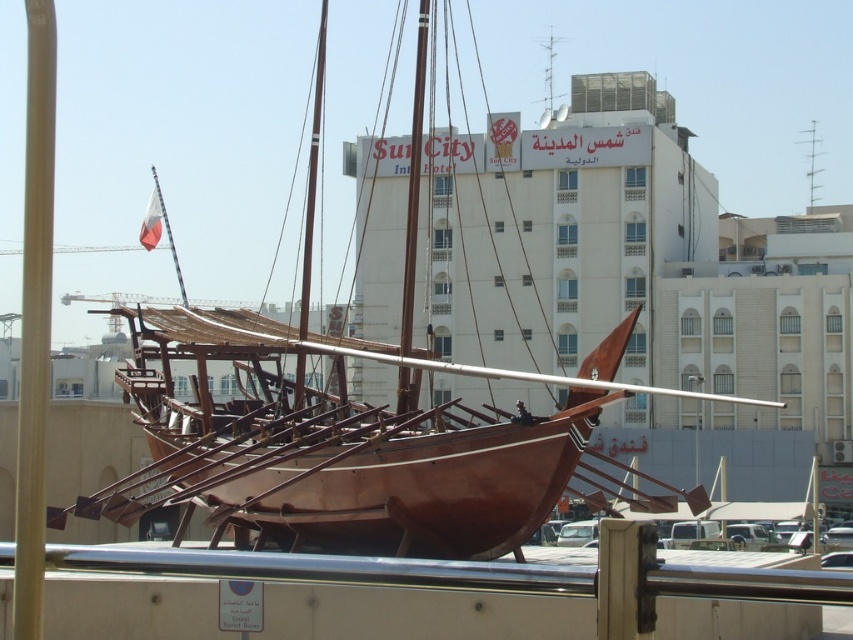
From the picture: You are standing at the point closest to the boat in the image. Which point, point (32, 369) or point (810, 120), is closer to you?

Point (32, 369) is closer to you because it is in front of point (810, 120).

You are a sailor planning to install a new sail on the wooden mast at left and the brown wooden mast at upper center. Which mast requires a taller sail to match its height?

The brown wooden mast at upper center requires a taller sail because it is taller than the wooden mast at left.

You are a tour guide explaining the boat to visitors. Pointing to the wooden mast at center and the brown wooden mast at upper center, you want to clarify their positions. Which mast is closer to the visitors?

The wooden mast at center is closer to the visitors because it is in front of the brown wooden mast at upper center.